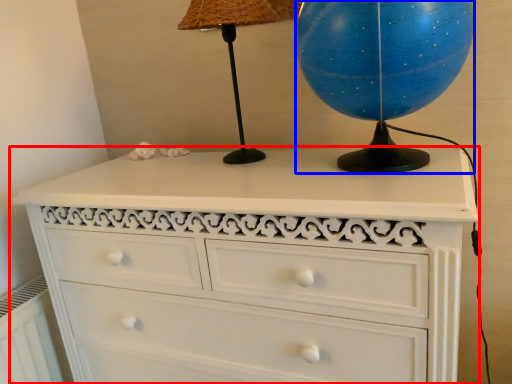
Question: Which of the following is the farthest to the observer, chest of drawers (highlighted by a red box) or sphere (highlighted by a blue box)?

Choices:
 (A) chest of drawers
 (B) sphere

Answer: (B)